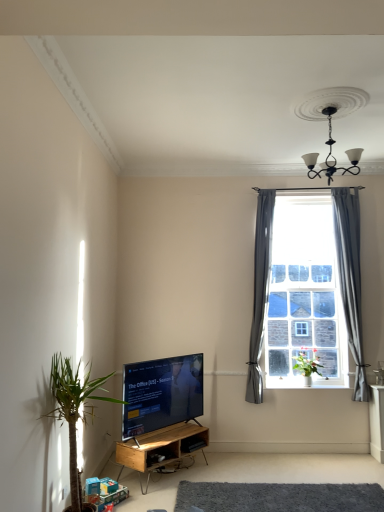
At what (x,y) coordinates should I click in order to perform the action: click on blank space situated above black wrought iron chandelier at upper right (from a real-world perspective). Please return your answer as a coordinate pair (x, y). Looking at the image, I should click on (323, 111).